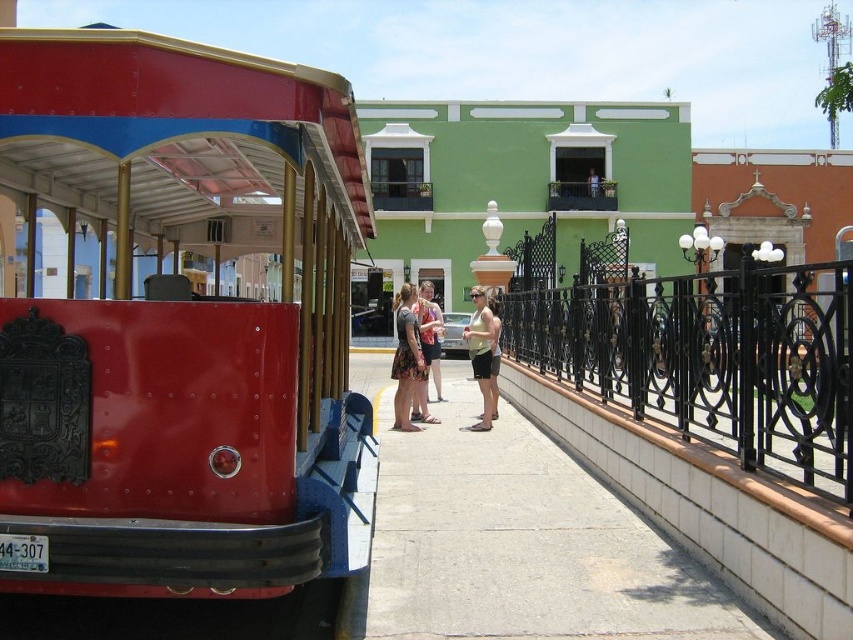
Question: Does metallic red trolley at left have a smaller size compared to matte pink dress at center?

Choices:
 (A) yes
 (B) no

Answer: (B)

Question: Which object is positioned farthest from the matte yellow tank top at center?

Choices:
 (A) metallic red trolley at left
 (B) black wrought iron fence at center

Answer: (A)

Question: Is matte yellow tank top at center further to camera compared to matte pink dress at center?

Choices:
 (A) yes
 (B) no

Answer: (A)

Question: Does black wrought iron fence at center appear on the right side of matte yellow tank top at center?

Choices:
 (A) no
 (B) yes

Answer: (B)

Question: Which of the following is the closest to the observer?

Choices:
 (A) (413, 460)
 (B) (434, 307)
 (C) (471, 300)
 (D) (175, 522)

Answer: (D)

Question: Which of these objects is positioned closest to the floral dress at center?

Choices:
 (A) matte yellow tank top at center
 (B) gray concrete pavement at center
 (C) metallic red trolley at left

Answer: (A)